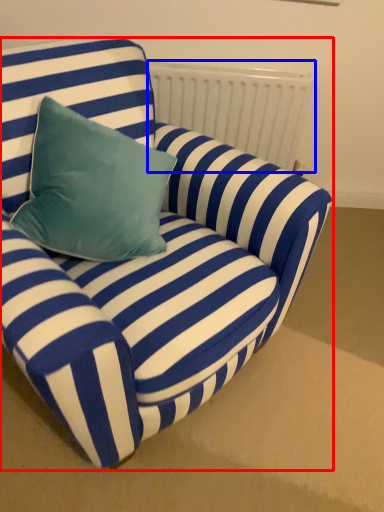
Question: Which object appears farthest to the camera in this image, studio couch (highlighted by a red box) or radiator (highlighted by a blue box)?

Choices:
 (A) studio couch
 (B) radiator

Answer: (B)